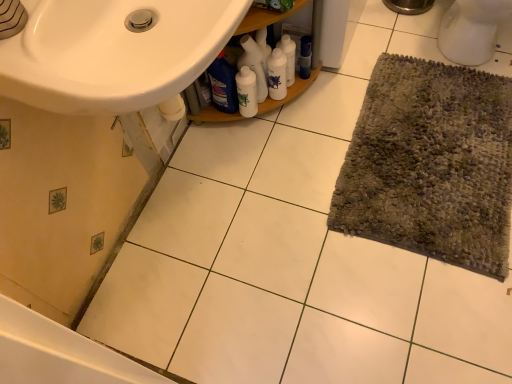
Question: Can you confirm if blue glossy bottle at center, the 1th cleaning product positioned from the left, is thinner than white glossy bottle at center, which ranks as the 3th cleaning product in right-to-left order?

Choices:
 (A) no
 (B) yes

Answer: (B)

Question: From the image's perspective, is blue glossy bottle at center, positioned as the 4th cleaning product in right-to-left order, on top of white glossy bottle at center, which ranks as the 3th cleaning product in right-to-left order?

Choices:
 (A) no
 (B) yes

Answer: (A)

Question: Is blue glossy bottle at center, positioned as the 4th cleaning product in right-to-left order, closer to camera compared to white glossy bottle at center, which ranks as the 3th cleaning product in right-to-left order?

Choices:
 (A) no
 (B) yes

Answer: (B)

Question: Can you confirm if blue glossy bottle at center, positioned as the 4th cleaning product in right-to-left order, is smaller than white glossy bottle at center, which ranks as the 2th cleaning product in left-to-right order?

Choices:
 (A) no
 (B) yes

Answer: (B)

Question: Does blue glossy bottle at center, the 1th cleaning product positioned from the left, come behind white glossy bottle at center, which ranks as the 3th cleaning product in right-to-left order?

Choices:
 (A) yes
 (B) no

Answer: (B)

Question: Considering the positions of white glossy bottles at center, arranged as the 3th cleaning product when viewed from the left, and blue glossy bottle at center, positioned as the 4th cleaning product in right-to-left order, in the image, is white glossy bottles at center, arranged as the 3th cleaning product when viewed from the left, bigger or smaller than blue glossy bottle at center, positioned as the 4th cleaning product in right-to-left order,?

Choices:
 (A) big
 (B) small

Answer: (B)

Question: From a real-world perspective, relative to blue glossy bottle at center, positioned as the 4th cleaning product in right-to-left order, is white glossy bottles at center, arranged as the 3th cleaning product when viewed from the left, vertically above or below?

Choices:
 (A) below
 (B) above

Answer: (A)

Question: Relative to blue glossy bottle at center, the 1th cleaning product positioned from the left, is white glossy bottles at center, arranged as the 3th cleaning product when viewed from the left, in front or behind?

Choices:
 (A) front
 (B) behind

Answer: (B)

Question: Would you say white glossy bottles at center, arranged as the 3th cleaning product when viewed from the left, is to the left or to the right of blue glossy bottle at center, the 1th cleaning product positioned from the left, in the picture?

Choices:
 (A) left
 (B) right

Answer: (B)

Question: From the image's perspective, relative to blue glossy bottle at center, positioned as the 4th cleaning product in right-to-left order, is white glossy bottles at center above or below?

Choices:
 (A) below
 (B) above

Answer: (B)

Question: Considering the relative positions of white glossy bottles at center and blue glossy bottle at center, positioned as the 4th cleaning product in right-to-left order, in the image provided, is white glossy bottles at center to the left or to the right of blue glossy bottle at center, positioned as the 4th cleaning product in right-to-left order,?

Choices:
 (A) left
 (B) right

Answer: (B)

Question: From a real-world perspective, relative to blue glossy bottle at center, the 1th cleaning product positioned from the left, is white glossy bottles at center vertically above or below?

Choices:
 (A) below
 (B) above

Answer: (B)

Question: Is white glossy bottles at center inside or outside of blue glossy bottle at center, the 1th cleaning product positioned from the left?

Choices:
 (A) inside
 (B) outside

Answer: (B)

Question: Considering the positions of white glossy bottle at center and multicolored textured rug at right in the image, is white glossy bottle at center taller or shorter than multicolored textured rug at right?

Choices:
 (A) short
 (B) tall

Answer: (B)

Question: From a real-world perspective, relative to multicolored textured rug at right, is white glossy bottle at center vertically above or below?

Choices:
 (A) above
 (B) below

Answer: (A)